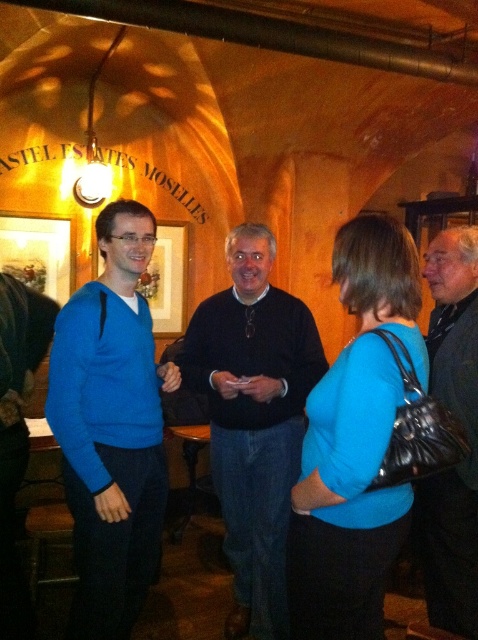
You are a photographer trying to capture a group photo of the blue matte shirt at center and the dark blue sweater at center. Since you want to ensure both are in focus, you need to know their heights. Which of the two is shorter?

The blue matte shirt at center is shorter than the dark blue sweater at center.

You are organizing a photo album and want to ensure that the blue matte shirt at center and the dark blue sweater at center are displayed properly. Based on their sizes in the image, which one should you allocate more space to in the album layout?

The dark blue sweater at center should be allocated more space in the album layout since it occupies more space than the blue matte shirt at center in the image.

You are a photographer trying to capture a candid shot of the group. You notice the blue matte shirt at center and the dark blue sweater at center. Which one is positioned higher in the frame?

The blue matte shirt at center is positioned higher in the frame than the dark blue sweater at center.